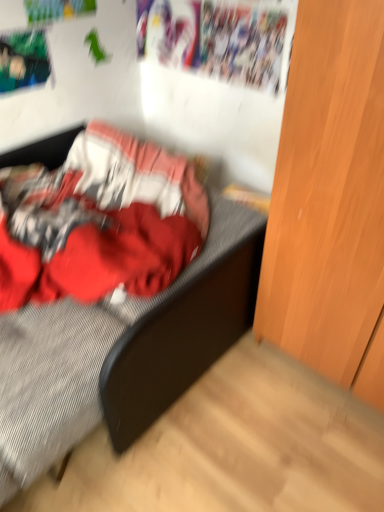
Question: Is textured gray bed at center smaller than light brown wood dresser at right?

Choices:
 (A) yes
 (B) no

Answer: (B)

Question: Is textured gray bed at center to the left of light brown wood dresser at right from the viewer's perspective?

Choices:
 (A) no
 (B) yes

Answer: (B)

Question: From a real-world perspective, is textured gray bed at center physically above light brown wood dresser at right?

Choices:
 (A) yes
 (B) no

Answer: (B)

Question: Can you confirm if textured gray bed at center is taller than light brown wood dresser at right?

Choices:
 (A) yes
 (B) no

Answer: (B)

Question: Considering the relative positions of textured gray bed at center and light brown wood dresser at right in the image provided, is textured gray bed at center behind light brown wood dresser at right?

Choices:
 (A) yes
 (B) no

Answer: (A)

Question: Is textured gray bed at center shorter than light brown wood dresser at right?

Choices:
 (A) no
 (B) yes

Answer: (B)

Question: Is light brown wood dresser at right to the left of textured gray bed at center from the viewer's perspective?

Choices:
 (A) no
 (B) yes

Answer: (A)

Question: Is light brown wood dresser at right taller than textured gray bed at center?

Choices:
 (A) no
 (B) yes

Answer: (B)

Question: Does light brown wood dresser at right lie behind textured gray bed at center?

Choices:
 (A) no
 (B) yes

Answer: (A)

Question: Is light brown wood dresser at right to the right of textured gray bed at center from the viewer's perspective?

Choices:
 (A) yes
 (B) no

Answer: (A)

Question: Is light brown wood dresser at right closer to camera compared to textured gray bed at center?

Choices:
 (A) yes
 (B) no

Answer: (A)

Question: Is light brown wood dresser at right positioned beyond the bounds of textured gray bed at center?

Choices:
 (A) no
 (B) yes

Answer: (B)

Question: Considering their positions, is light brown wood dresser at right located in front of or behind textured gray bed at center?

Choices:
 (A) front
 (B) behind

Answer: (A)